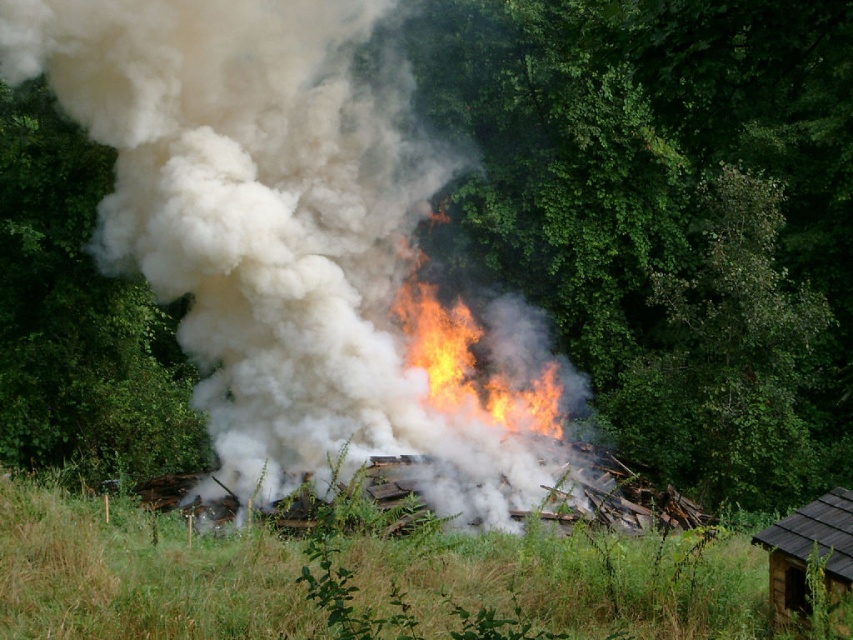
You are a firefighter assessing the scene. You notice the flaming debris at center and the green grass at lower center. Based on their positions, which object is closer to you as you approach the fire?

The flaming debris at center is closer to you because it is further to the viewer than the green grass at lower center, meaning it occupies a more forward position in the scene.

You are a firefighter assessing the fire scene. You notice the green grass at lower center and the green leafy tree at left. Which object is closer to the ground?

The green grass at lower center is shorter than the green leafy tree at left, so the green grass at lower center is closer to the ground.

You are a firefighter assessing the fire scene. You see the flaming debris at center and the brown wooden hut at lower right. Which object is positioned higher in the image?

The flaming debris at center is located above the brown wooden hut at lower right, so it is positioned higher in the image.